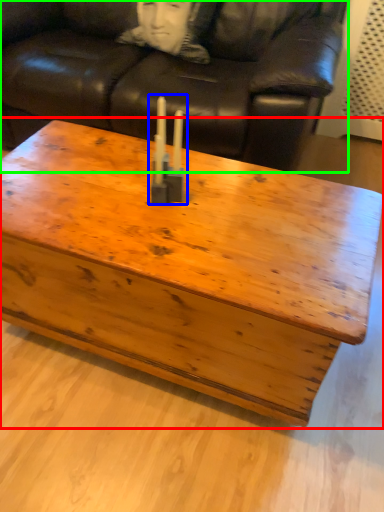
Question: Estimate the real-world distances between objects in this image. Which object is closer to coffee table (highlighted by a red box), candle holder (highlighted by a blue box) or studio couch (highlighted by a green box)?

Choices:
 (A) candle holder
 (B) studio couch

Answer: (A)